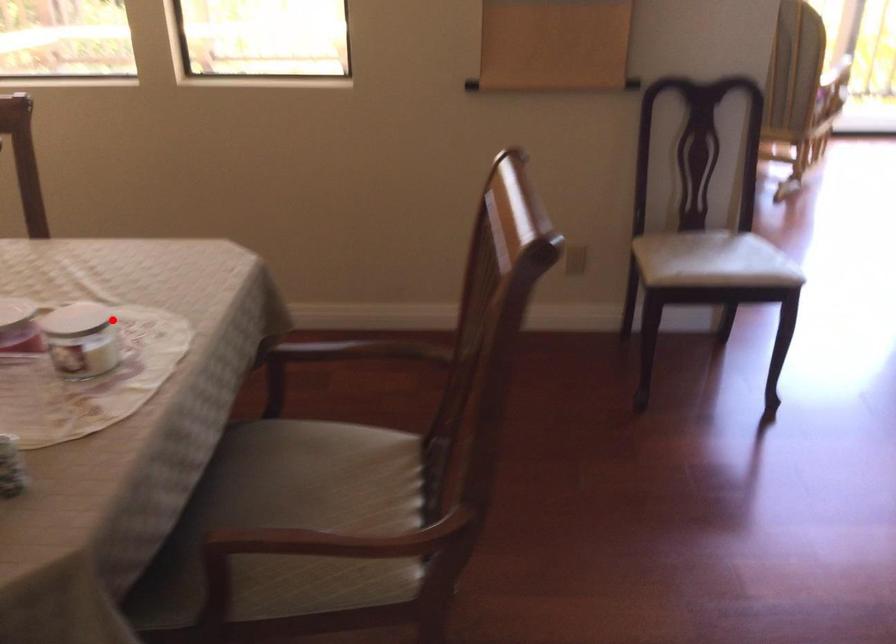
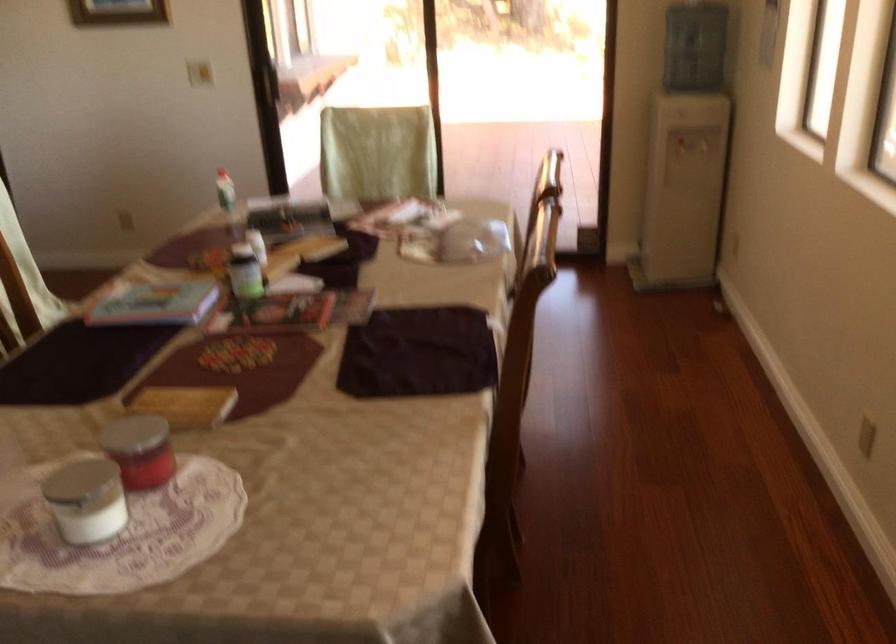
Locate, in the second image, the point that corresponds to the highlighted location in the first image.

(85, 500)